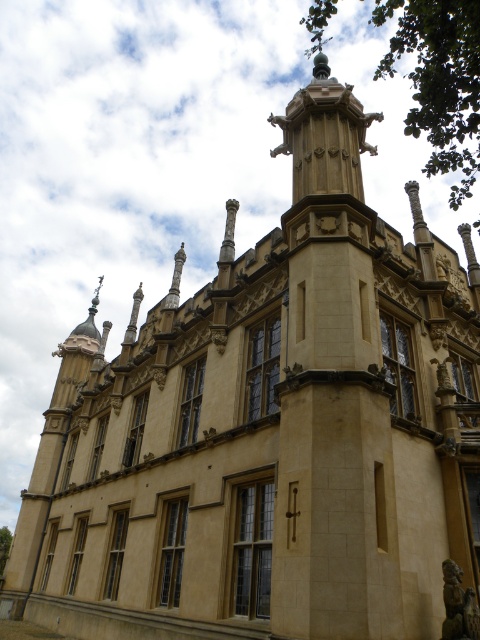
Question: Can you confirm if green leafy tree at upper center is smaller than green leafy tree at lower left?

Choices:
 (A) no
 (B) yes

Answer: (A)

Question: Is green leafy tree at upper center thinner than brown stone statue at lower right?

Choices:
 (A) yes
 (B) no

Answer: (B)

Question: Does brown stone statue at lower right have a larger size compared to green leafy tree at lower left?

Choices:
 (A) no
 (B) yes

Answer: (A)

Question: Which point is farther to the camera?

Choices:
 (A) green leafy tree at lower left
 (B) brown stone statue at lower right

Answer: (A)

Question: Which object is closer to the camera taking this photo?

Choices:
 (A) green leafy tree at lower left
 (B) green leafy tree at upper center

Answer: (B)

Question: Among these objects, which one is farthest from the camera?

Choices:
 (A) green leafy tree at lower left
 (B) green leafy tree at upper center
 (C) brown stone statue at lower right

Answer: (A)